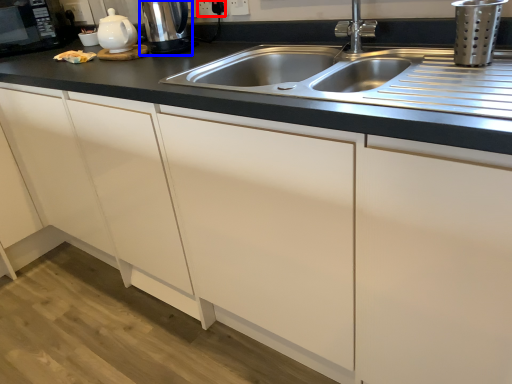
Question: Which of the following is the farthest to the observer, electric outlet (highlighted by a red box) or coffee machine (highlighted by a blue box)?

Choices:
 (A) electric outlet
 (B) coffee machine

Answer: (A)